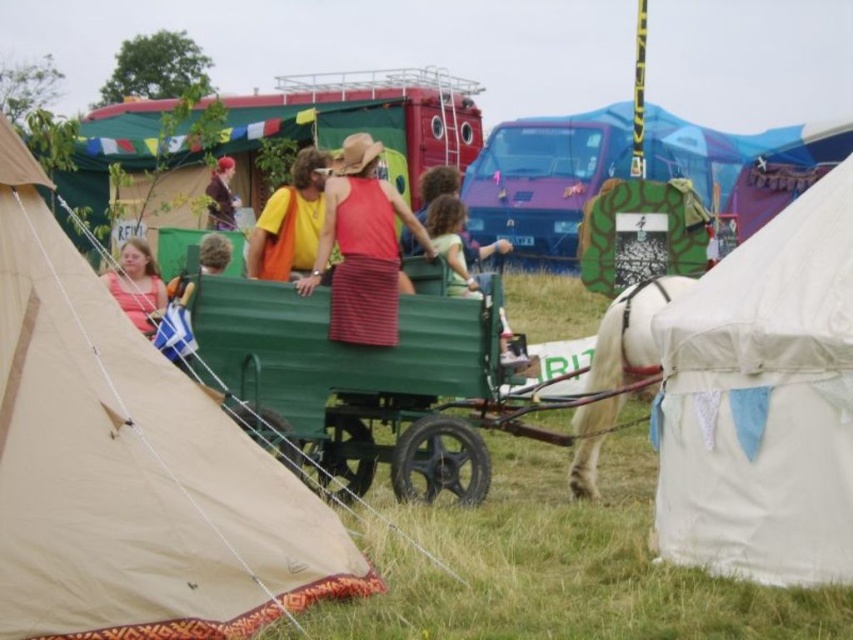
Is white canvas tent at lower right bigger than matte pink shirt at center?

Indeed, white canvas tent at lower right has a larger size compared to matte pink shirt at center.

Can you confirm if white canvas tent at lower right is thinner than matte pink shirt at center?

No.

Does point (694, 296) come behind point (132, 308)?

No, it is in front of (132, 308).

Identify the location of white canvas tent at lower right. (762, 403).

Locate an element on the screen. beige canvas tent at center is located at coordinates (131, 467).

Who is positioned more to the right, beige canvas tent at center or shiny brown jacket at center?

From the viewer's perspective, beige canvas tent at center appears more on the right side.

Locate an element on the screen. beige canvas tent at center is located at coordinates (131, 467).

Between green corrugated wagon at center and curly-haired child at center, which one has less height?

green corrugated wagon at center

Can you confirm if green corrugated wagon at center is positioned below curly-haired child at center?

Yes, green corrugated wagon at center is below curly-haired child at center.

Where is `green corrugated wagon at center`? The image size is (853, 640). green corrugated wagon at center is located at coordinates (355, 384).